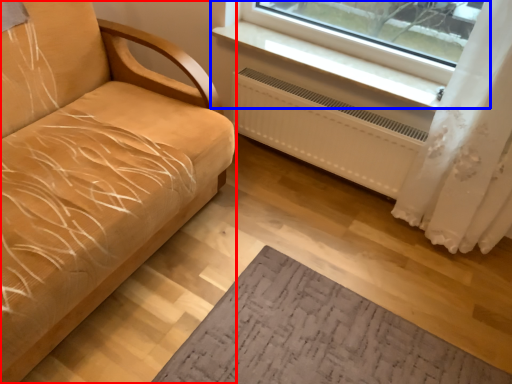
Question: Which of the following is the closest to the observer, studio couch (highlighted by a red box) or window (highlighted by a blue box)?

Choices:
 (A) studio couch
 (B) window

Answer: (A)